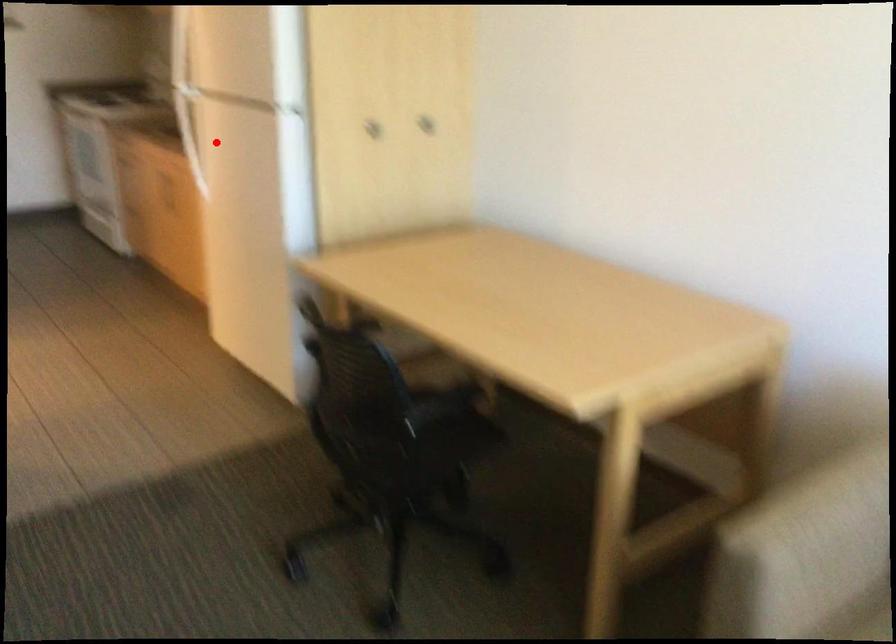
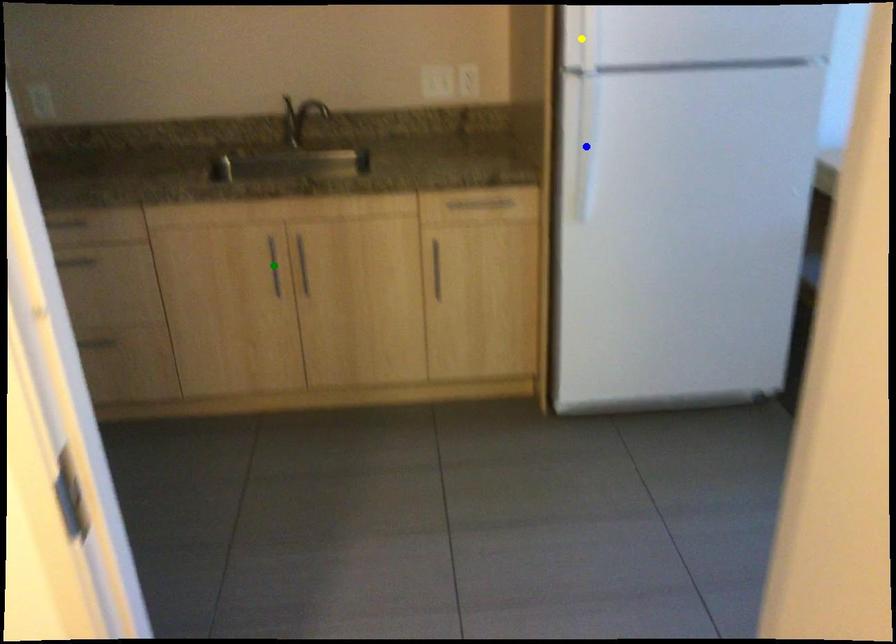
Question: I am providing you with two images of the same scene from different viewpoints. A red point is marked on the first image. You are given multiple points on the second image. Which point in image 2 is actually the same real-world point as the red point in image 1?

Choices:
 (A) yellow point
 (B) green point
 (C) blue point

Answer: (C)